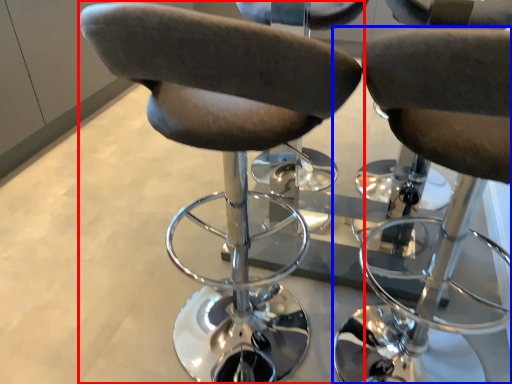
Question: Which object appears farthest to the camera in this image, chair (highlighted by a red box) or chair (highlighted by a blue box)?

Choices:
 (A) chair
 (B) chair

Answer: (A)